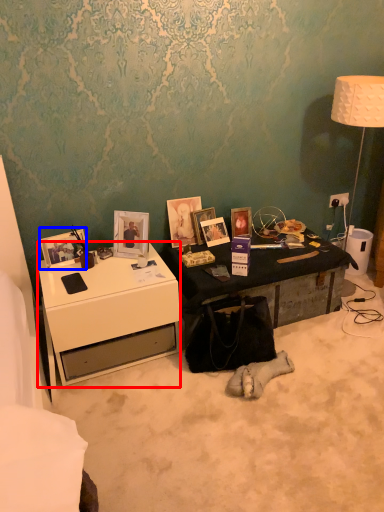
Question: Which point is further to the camera, desk (highlighted by a red box) or picture frame (highlighted by a blue box)?

Choices:
 (A) desk
 (B) picture frame

Answer: (B)